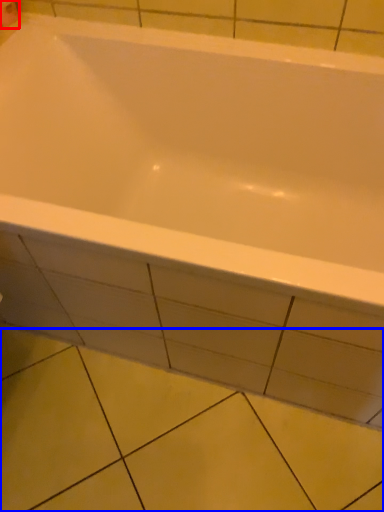
Question: Which point is closer to the camera, toilet paper (highlighted by a red box) or ceramic tile (highlighted by a blue box)?

Choices:
 (A) toilet paper
 (B) ceramic tile

Answer: (B)